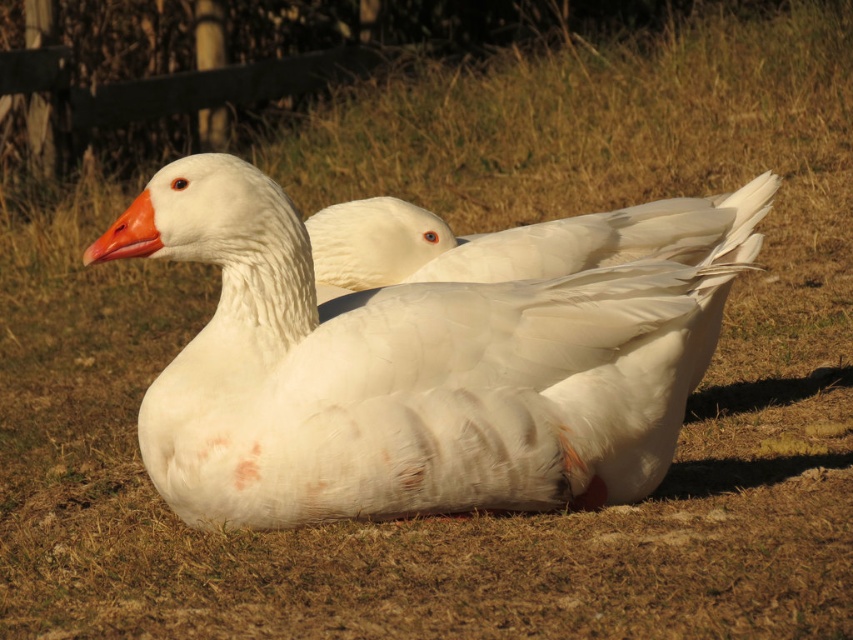
Question: Is white feathered goose at center above orange matte beak at center?

Choices:
 (A) no
 (B) yes

Answer: (B)

Question: Does white feathered duck at center appear on the left side of orange matte beak at center?

Choices:
 (A) yes
 (B) no

Answer: (B)

Question: From the image, what is the correct spatial relationship of white feathered goose at center in relation to orange matte beak at center?

Choices:
 (A) below
 (B) above

Answer: (B)

Question: Considering the real-world distances, which object is farthest from the white feathered duck at center?

Choices:
 (A) orange matte beak at center
 (B) white feathered goose at center

Answer: (A)

Question: Which object is closer to the camera taking this photo?

Choices:
 (A) white feathered duck at center
 (B) white feathered goose at center
 (C) orange matte beak at center

Answer: (A)

Question: Which object is farther from the camera taking this photo?

Choices:
 (A) white feathered goose at center
 (B) white feathered duck at center

Answer: (A)